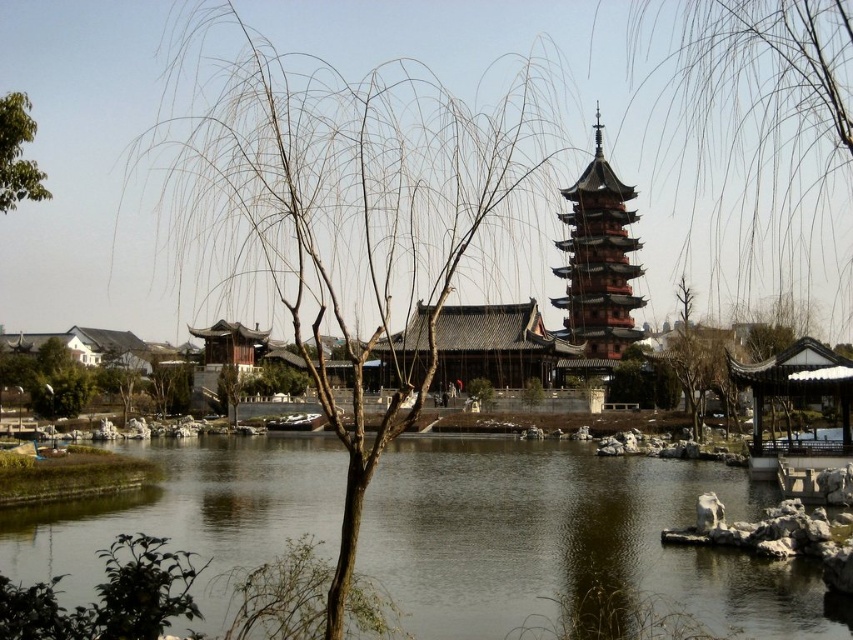
Question: Is brown water at center positioned at the back of bare branches at upper center?

Choices:
 (A) yes
 (B) no

Answer: (B)

Question: Which of the following is the farthest from the observer?

Choices:
 (A) brown water at center
 (B) reddish-brown wooden pagoda at center-right
 (C) green leafy tree at upper left

Answer: (B)

Question: Is bare wood tree at center above reddish-brown wooden pagoda at center-right?

Choices:
 (A) yes
 (B) no

Answer: (B)

Question: Is brown water at center behind green leafy tree at upper left?

Choices:
 (A) no
 (B) yes

Answer: (A)

Question: Which of the following is the farthest from the observer?

Choices:
 (A) bare wood tree at center
 (B) reddish-brown wooden pagoda at center-right
 (C) brown water at center

Answer: (B)

Question: Which object appears closest to the camera in this image?

Choices:
 (A) brown water at center
 (B) bare wood tree at center
 (C) green leafy tree at upper left
 (D) bare branches at upper center

Answer: (B)